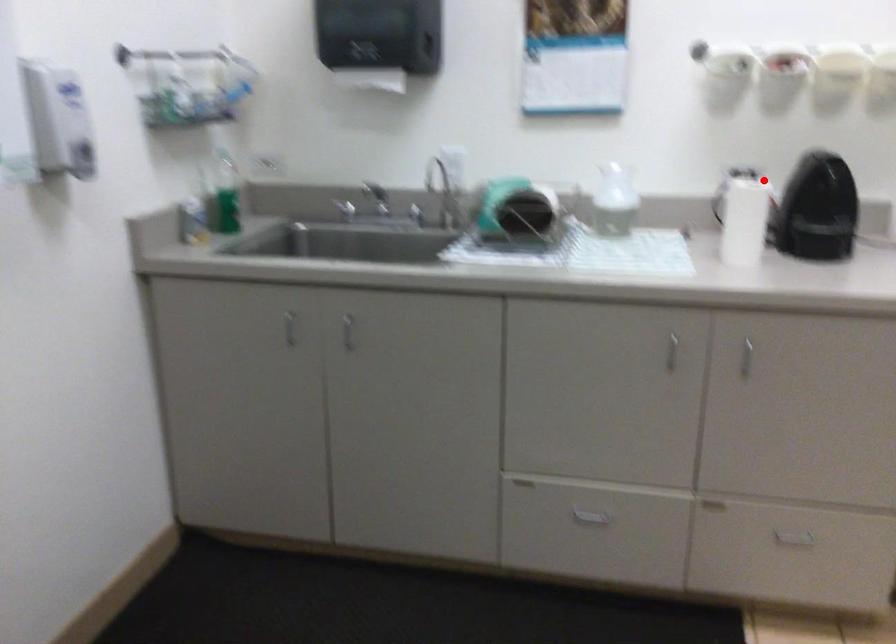
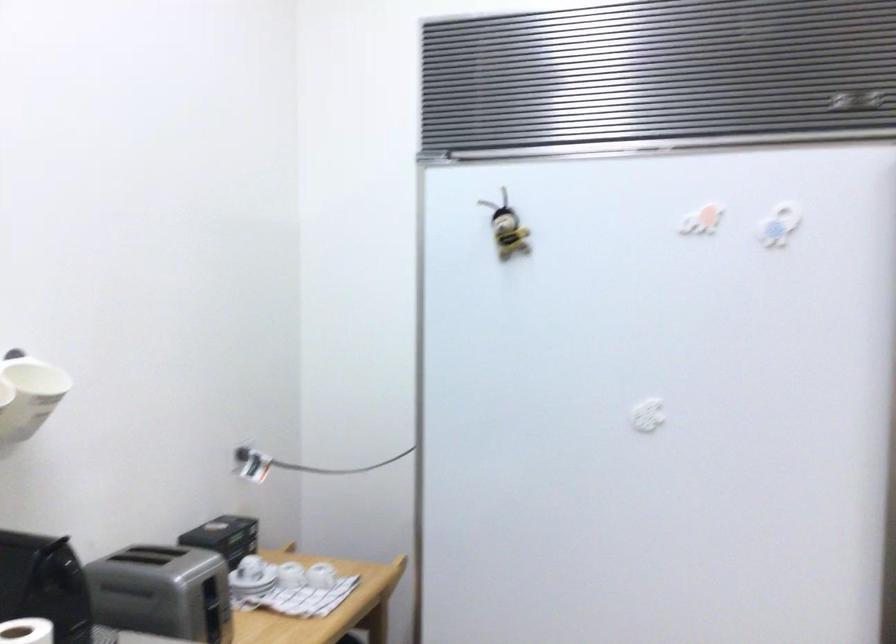
Where in the second image is the point corresponding to the highlighted location from the first image?

(26, 630)